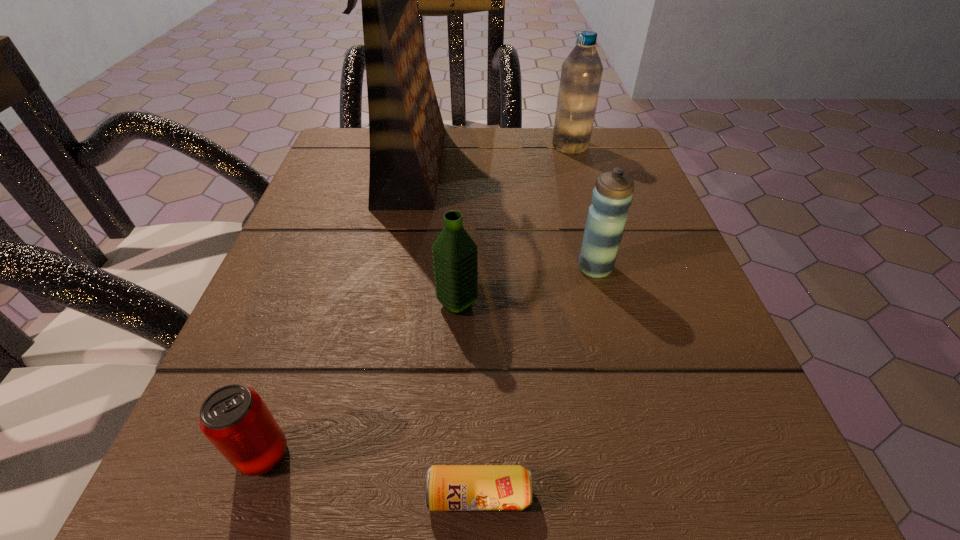
The image size is (960, 540). I want to click on the second closest water bottle to the beer can, so 612,195.

Find the location of a particular element. The width and height of the screenshot is (960, 540). vacant space that satisfies the following two spatial constraints: 1. on the front-facing side of the shopping bag; 2. on the right side of the nearest water bottle is located at coordinates (387, 305).

Identify the location of free region that satisfies the following two spatial constraints: 1. on the front-facing side of the tallest object; 2. on the back side of the leftmost water bottle. The width and height of the screenshot is (960, 540). (387, 305).

Find the location of `free space that satisfies the following two spatial constraints: 1. on the front side of the nearest water bottle; 2. on the right side of the beer can`. free space that satisfies the following two spatial constraints: 1. on the front side of the nearest water bottle; 2. on the right side of the beer can is located at coordinates click(x=448, y=495).

Locate an element on the screen. free space in the image that satisfies the following two spatial constraints: 1. on the front side of the farthest water bottle; 2. on the front-facing side of the tallest object is located at coordinates [x=576, y=164].

This screenshot has height=540, width=960. I want to click on blank space that satisfies the following two spatial constraints: 1. on the back side of the tallest water bottle; 2. on the left side of the nearest water bottle, so click(x=465, y=146).